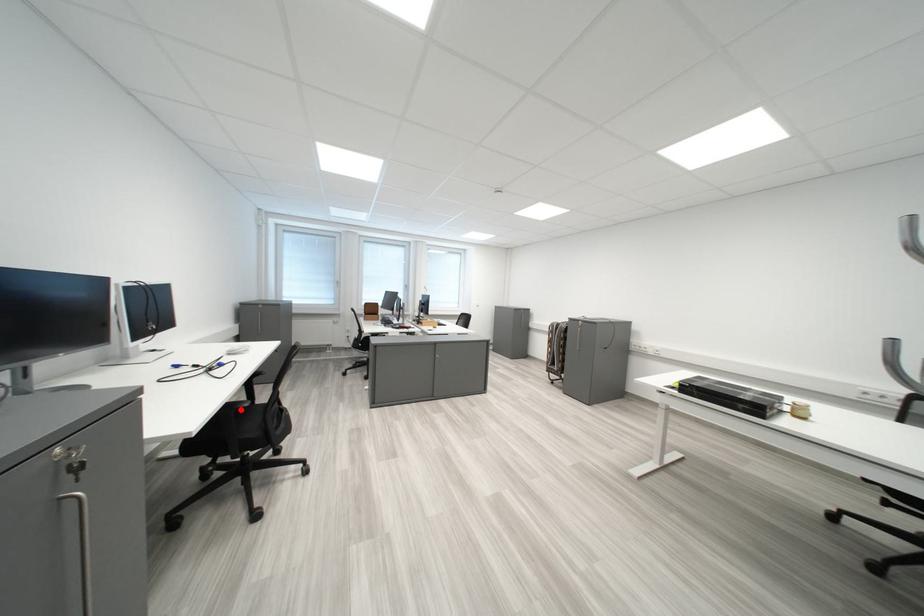
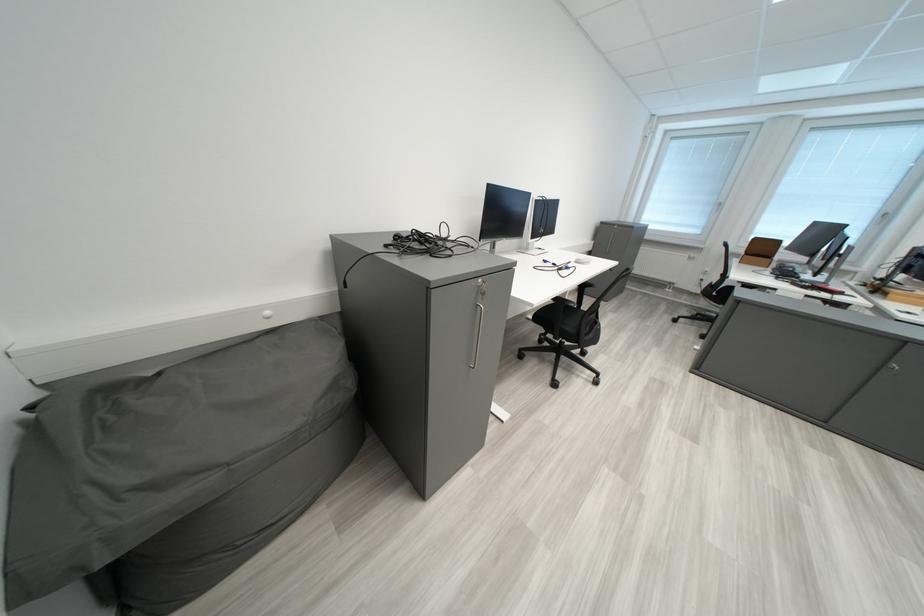
Question: I am providing you with two images of the same scene from different viewpoints. Image1 has a red point marked. In image2, the corresponding 3D location appears at what relative position? Reply with the corresponding letter.

Choices:
 (A) Closer
 (B) Farther

Answer: (B)